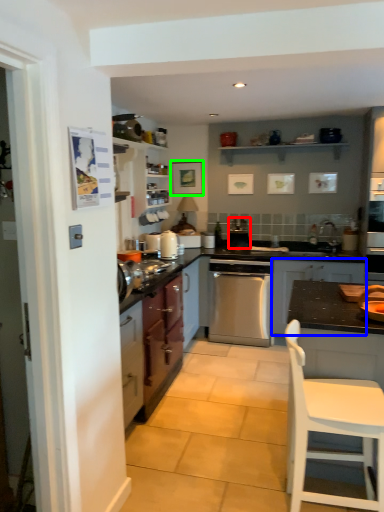
Question: Which is nearer to the appliance (highlighted by a red box)? cabinetry (highlighted by a blue box) or picture frame (highlighted by a green box).

Choices:
 (A) cabinetry
 (B) picture frame

Answer: (B)